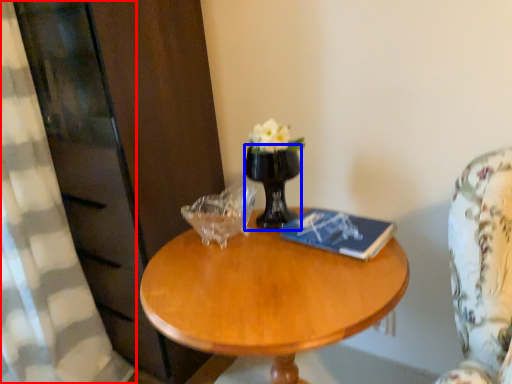
Question: Which point is further to the camera, curtain (highlighted by a red box) or vase (highlighted by a blue box)?

Choices:
 (A) curtain
 (B) vase

Answer: (B)